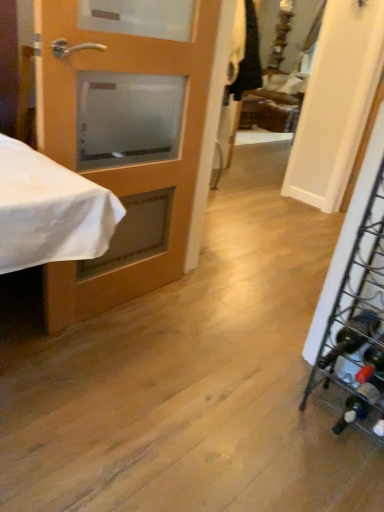
I want to click on free location to the left of metallic wire wine rack at right, so click(287, 415).